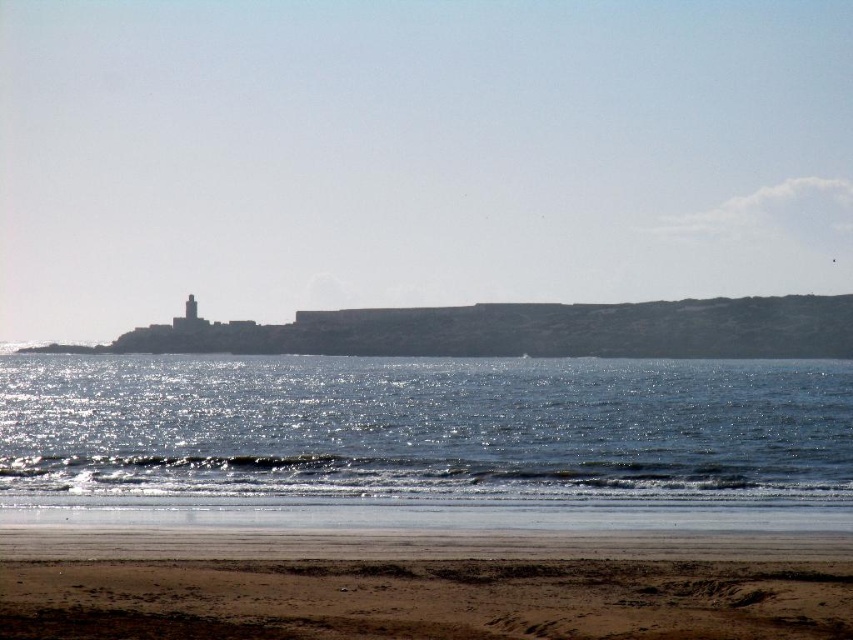
Does glistening water at lower center come in front of brown sandy beach at lower center?

No, it is behind brown sandy beach at lower center.

In the scene shown: Is glistening water at lower center taller than brown sandy beach at lower center?

Indeed, glistening water at lower center has a greater height compared to brown sandy beach at lower center.

Who is more forward, (x=444, y=429) or (x=480, y=572)?

Point (x=480, y=572) is more forward.

Where is `glistening water at lower center`? glistening water at lower center is located at coordinates (426, 428).